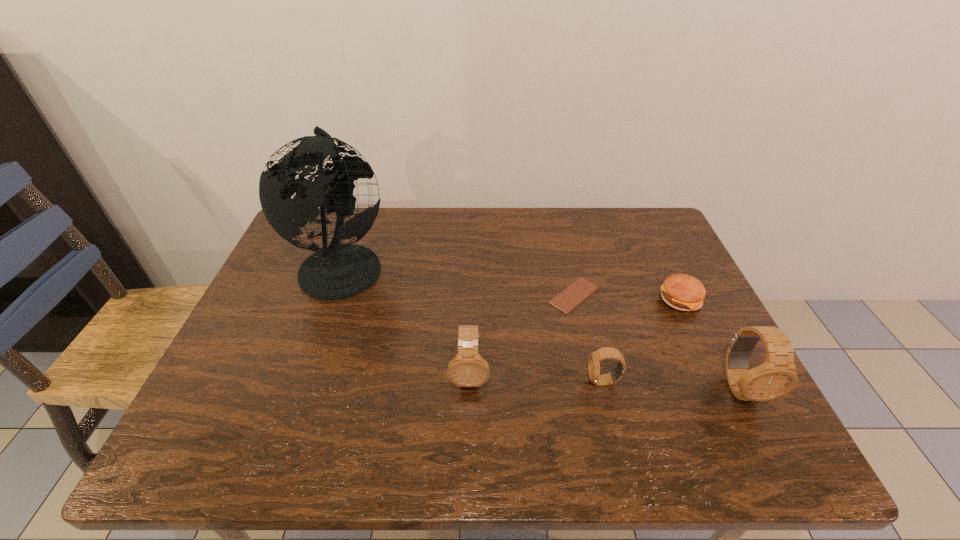
The image size is (960, 540). Find the location of `object positioned at the near right corner`. object positioned at the near right corner is located at coordinates coord(777,376).

This screenshot has width=960, height=540. Identify the location of vacant area at the far edge of the desktop. [545, 219].

The width and height of the screenshot is (960, 540). I want to click on blank space at the near edge of the desktop, so click(429, 414).

Locate an element on the screen. The width and height of the screenshot is (960, 540). vacant space at the left edge of the desktop is located at coordinates (276, 335).

Locate an element on the screen. The image size is (960, 540). free space at the right edge is located at coordinates (661, 307).

At what (x,y) coordinates should I click in order to perform the action: click on free region at the near left corner of the desktop. Please return your answer as a coordinate pair (x, y). The width and height of the screenshot is (960, 540). Looking at the image, I should click on (276, 402).

You are a GUI agent. You are given a task and a screenshot of the screen. Output one action in this format:
    pyautogui.click(x=<x>, y=<y>)
    Task: Click on the vacant point located between the shortest watch and the tallest object
    
    Given the screenshot: What is the action you would take?
    pyautogui.click(x=473, y=323)

In order to click on free space between the shortest watch and the second shortest watch in this screenshot , I will do `click(537, 379)`.

Identify the location of empty location between the hamburger and the rightmost watch. Image resolution: width=960 pixels, height=540 pixels. (710, 343).

Locate an element on the screen. This screenshot has height=540, width=960. free space between the leftmost object and the second shortest object is located at coordinates (512, 282).